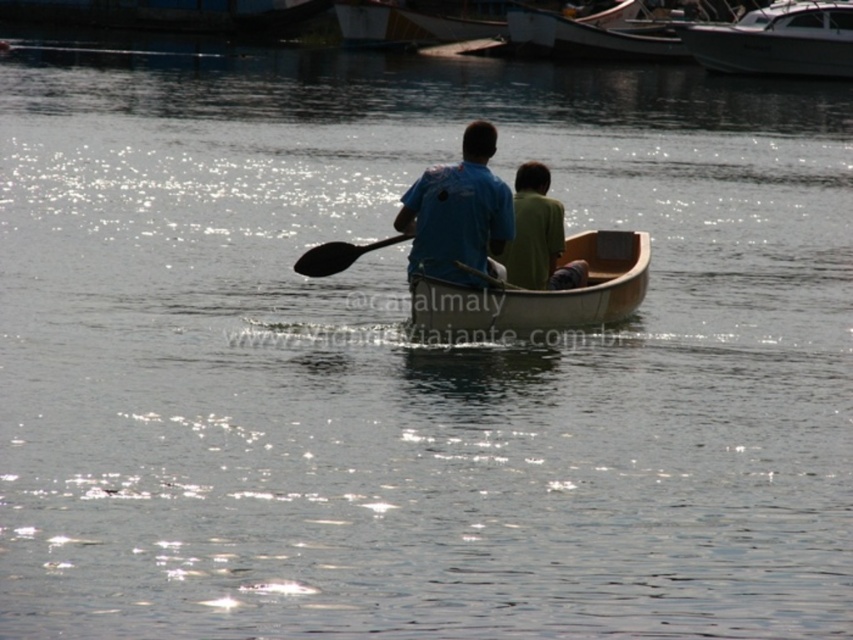
You are standing on the dock and want to wave to the person wearing the matte blue shirt at center. Which direction should you face to ensure they see your greeting?

The matte blue shirt at center is located at point 0.333 along the horizontal axis and 0.538 along the vertical axis, so you should face slightly to the left and forward to ensure they see your greeting.